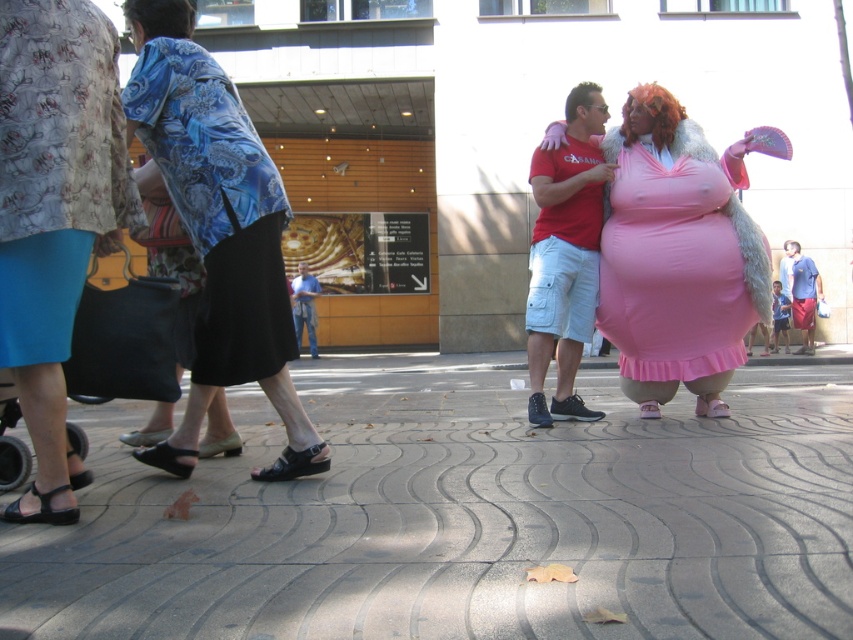
Question: Is matte blue-patterned blouse at center-left to the right of brown synthetic wig at upper left from the viewer's perspective?

Choices:
 (A) no
 (B) yes

Answer: (B)

Question: Is matte red t-shirt at center closer to camera compared to blue jeans at center?

Choices:
 (A) yes
 (B) no

Answer: (A)

Question: Which object is the closest to the blue denim shorts at right?

Choices:
 (A) blue jeans at center
 (B) orange synthetic wig at upper right
 (C) pink satin dress at center

Answer: (C)

Question: Which point is farther to the camera?

Choices:
 (A) (146, 10)
 (B) (267, 198)

Answer: (A)

Question: Among these points, which one is farthest from the camera?

Choices:
 (A) (281, 260)
 (B) (309, 280)

Answer: (B)

Question: Does floral fabric skirt at lower left appear under orange synthetic wig at upper right?

Choices:
 (A) yes
 (B) no

Answer: (A)